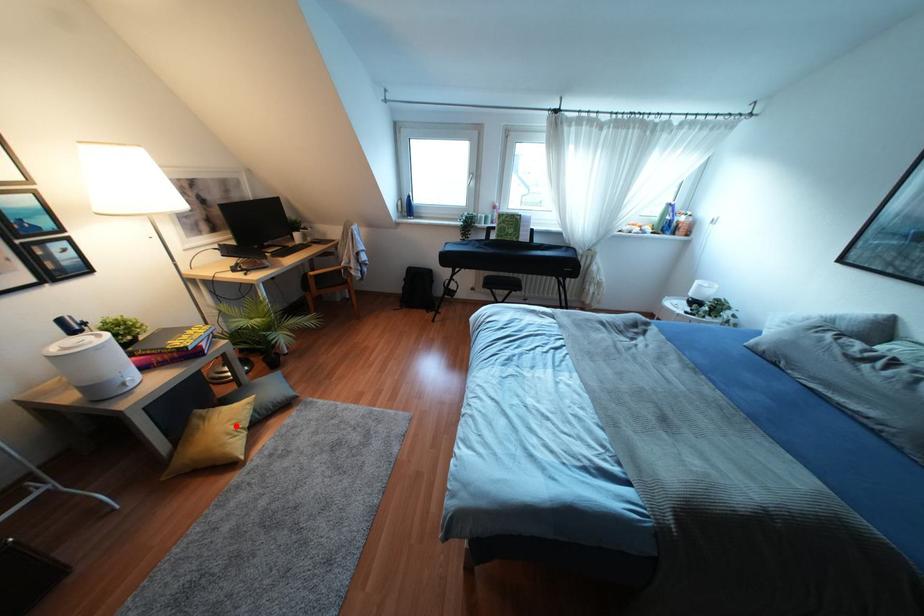
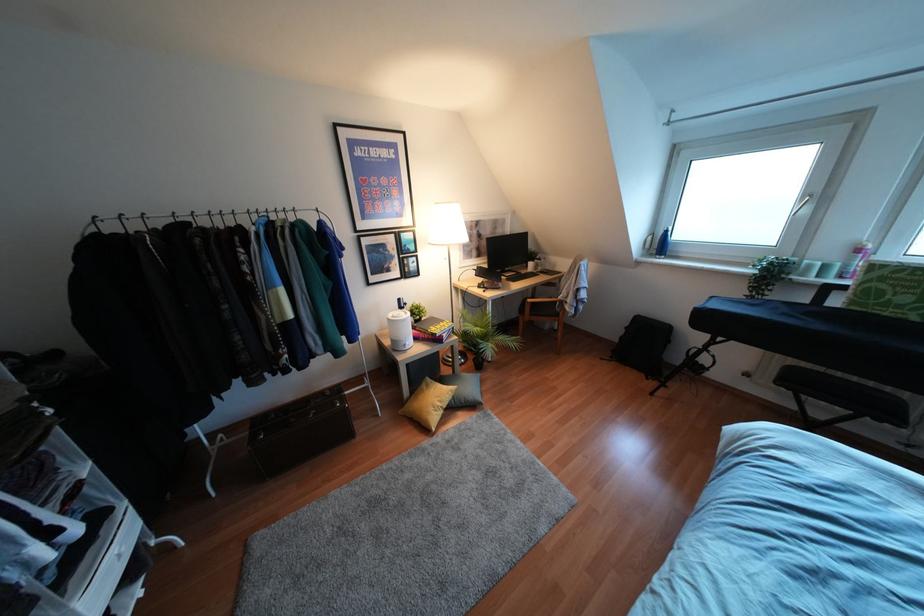
Question: I am providing you with two images of the same scene from different viewpoints. A red point is shown in image1. For the corresponding object point in image2, is it positioned nearer or farther from the camera?

Choices:
 (A) Nearer
 (B) Farther

Answer: (B)